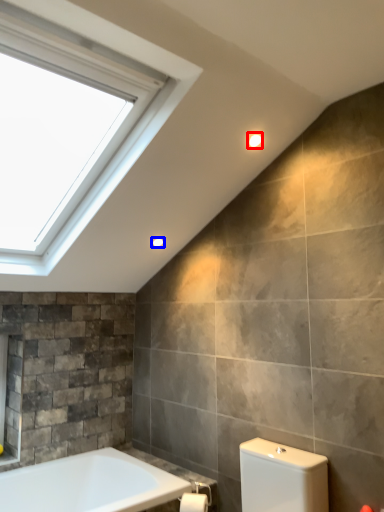
Question: Which object is closer to the camera taking this photo, light fixture (highlighted by a red box) or light fixture (highlighted by a blue box)?

Choices:
 (A) light fixture
 (B) light fixture

Answer: (A)